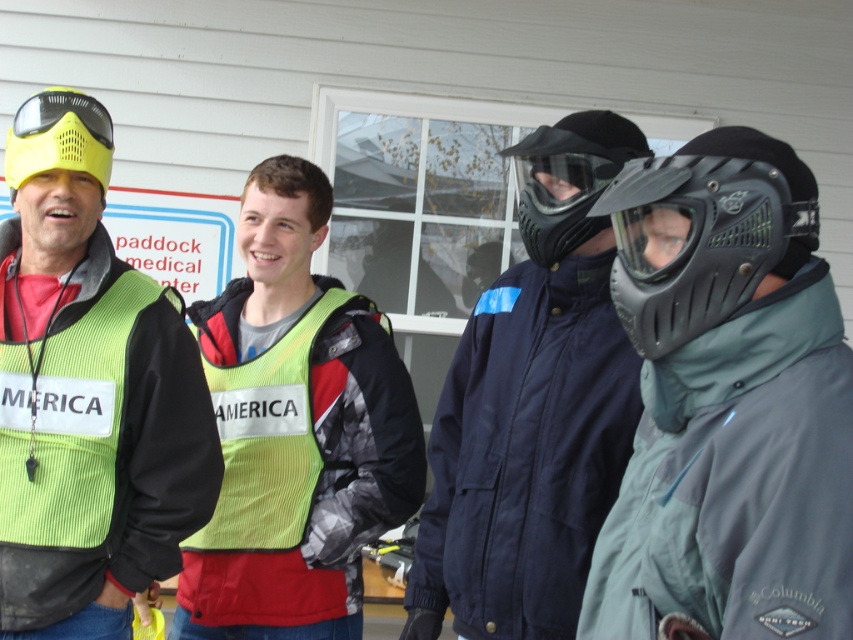
Can you confirm if yellow reflective vest at center is positioned to the left of black matte helmet at right?

Correct, you'll find yellow reflective vest at center to the left of black matte helmet at right.

Looking at this image, does yellow reflective vest at center appear on the right side of black matte helmet at right?

No, yellow reflective vest at center is not to the right of black matte helmet at right.

In order to click on yellow reflective vest at center in this screenshot , I will do `click(299, 467)`.

Between point (601, 380) and point (18, 124), which one is positioned in front?

Point (601, 380) is in front.

Who is positioned more to the left, navy blue jacket at center or matte yellow helmet at upper left?

matte yellow helmet at upper left is more to the left.

The image size is (853, 640). I want to click on navy blue jacket at center, so click(x=527, y=436).

From the picture: Can you confirm if navy blue jacket at center is positioned to the left of black matte mask at center?

Yes, navy blue jacket at center is to the left of black matte mask at center.

Can you confirm if navy blue jacket at center is positioned to the right of black matte mask at center?

In fact, navy blue jacket at center is to the left of black matte mask at center.

Find the location of a particular element. navy blue jacket at center is located at coordinates pyautogui.click(x=527, y=436).